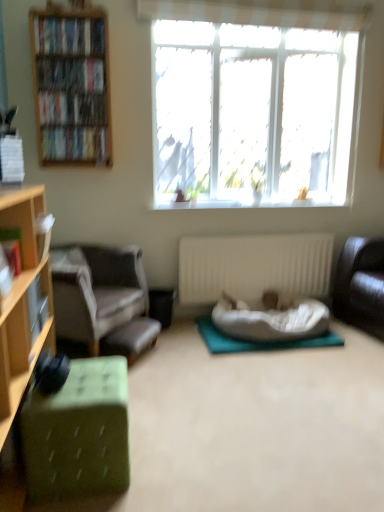
This screenshot has width=384, height=512. Identify the location of vacant area that lies to the right of green fabric footrest at lower left. (183, 352).